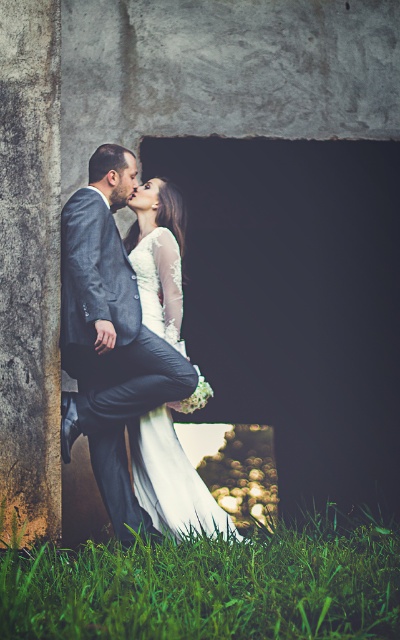
Measure the distance between point (78, 250) and camera.

Point (78, 250) is 3.77 meters away from camera.

Is matte gray suit at center to the right of white satin dress at center from the viewer's perspective?

No, matte gray suit at center is not to the right of white satin dress at center.

Does point (84, 252) lie behind point (175, 451)?

That is False.

Locate an element on the screen. The height and width of the screenshot is (640, 400). matte gray suit at center is located at coordinates (110, 336).

Between green grass at lower center and matte gray suit at center, which one has less height?

green grass at lower center is shorter.

Can you confirm if green grass at lower center is bigger than matte gray suit at center?

Yes.

Locate an element on the screen. This screenshot has height=640, width=400. green grass at lower center is located at coordinates (208, 588).

You are a GUI agent. You are given a task and a screenshot of the screen. Output one action in this format:
    pyautogui.click(x=<x>, y=<y>)
    Task: Click on the matte gray suit at center
    
    Given the screenshot: What is the action you would take?
    pyautogui.click(x=110, y=336)

The width and height of the screenshot is (400, 640). What do you see at coordinates (110, 336) in the screenshot?
I see `matte gray suit at center` at bounding box center [110, 336].

Which is behind, point (108, 172) or point (124, 164)?

Positioned behind is point (124, 164).

The image size is (400, 640). I want to click on matte gray suit at center, so click(110, 336).